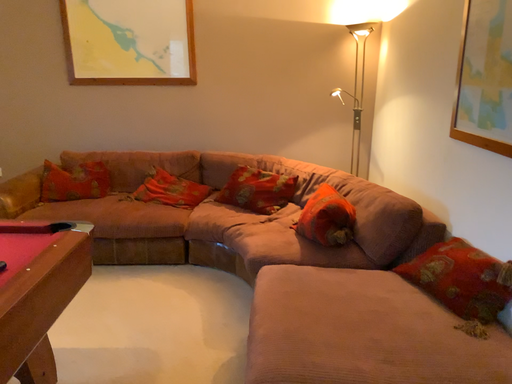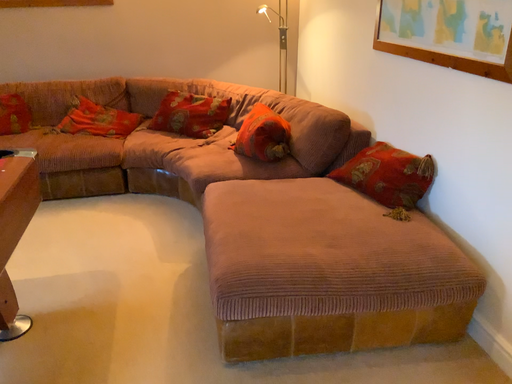
Question: Which way did the camera rotate in the video?

Choices:
 (A) rotated left
 (B) rotated right

Answer: (B)